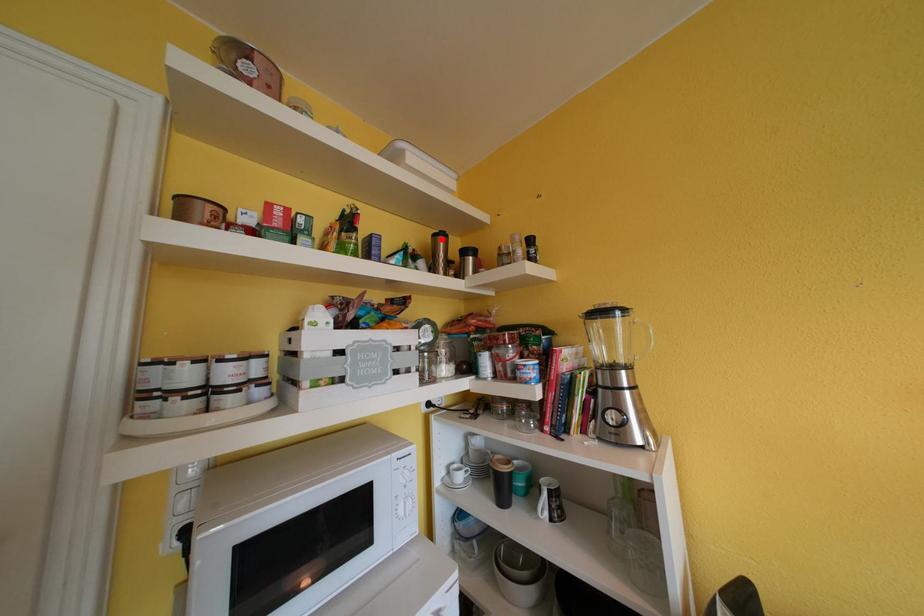
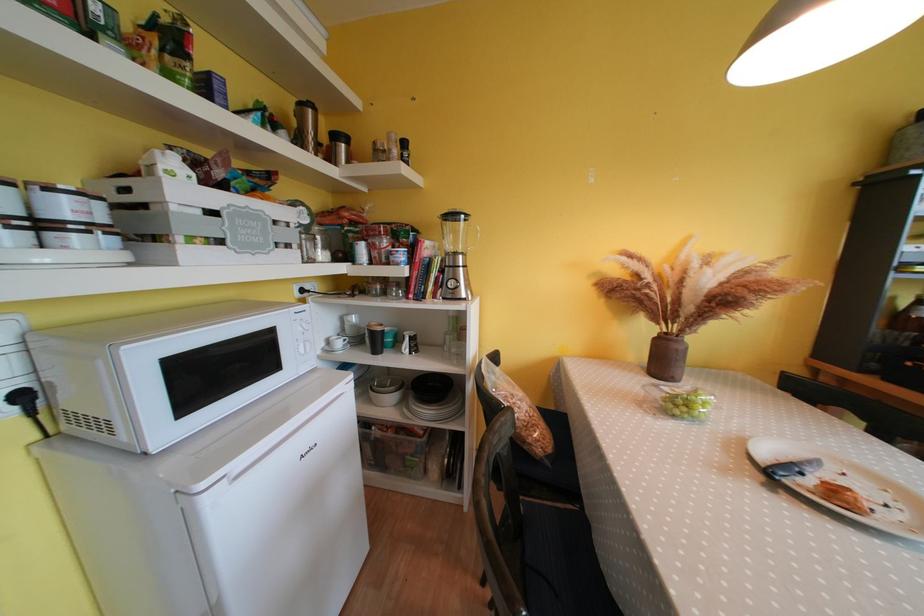
The point at the highlighted location is marked in the first image. Where is the corresponding point in the second image?

(308, 108)